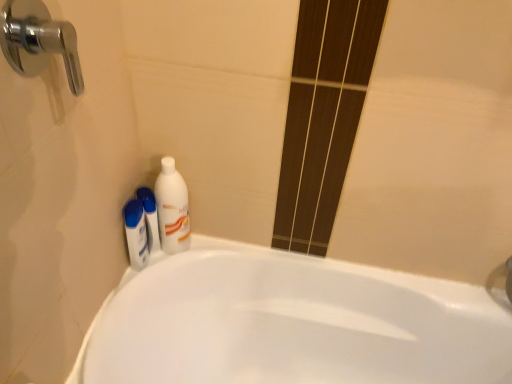
This screenshot has width=512, height=384. What do you see at coordinates (291, 323) in the screenshot? I see `white glossy bathtub at lower left` at bounding box center [291, 323].

Find the location of a particular element. The height and width of the screenshot is (384, 512). chrome metallic faucet at upper left is located at coordinates (38, 41).

In order to click on white glossy bottle at lower left, placed as the 2th mouthwash when sorted from left to right in this screenshot , I will do `click(150, 217)`.

What do you see at coordinates (150, 217) in the screenshot? Image resolution: width=512 pixels, height=384 pixels. I see `white glossy bottle at lower left, placed as the 2th mouthwash when sorted from left to right` at bounding box center [150, 217].

Locate an element on the screen. Image resolution: width=512 pixels, height=384 pixels. white glossy bottle at upper left is located at coordinates (172, 208).

What do you see at coordinates (136, 234) in the screenshot? I see `white glossy mouthwash at lower left, marked as the first mouthwash in a left-to-right arrangement` at bounding box center [136, 234].

Locate an element on the screen. Image resolution: width=512 pixels, height=384 pixels. white glossy bathtub at lower left is located at coordinates (291, 323).

From a real-world perspective, which object stands above the other?

In real-world perspective, white glossy bottle at upper left is above.

Is white glossy bathtub at lower left closer to camera compared to white glossy bottle at upper left?

Yes, it is in front of white glossy bottle at upper left.

Between white glossy bathtub at lower left and white glossy bottle at upper left, which one has larger width?

Wider between the two is white glossy bathtub at lower left.

How far apart are white glossy bathtub at lower left and white glossy bottle at upper left?

white glossy bathtub at lower left is 13.83 inches away from white glossy bottle at upper left.

Which is less distant, (141, 336) or (12, 15)?

Point (141, 336) appears to be farther away from the viewer than point (12, 15).

From the image's perspective, between white glossy bathtub at lower left and chrome metallic faucet at upper left, which one is located above?

From the image's view, chrome metallic faucet at upper left is above.

Based on the photo, measure the distance from white glossy bathtub at lower left to chrome metallic faucet at upper left.

white glossy bathtub at lower left is 81.06 centimeters away from chrome metallic faucet at upper left.

Is white glossy bathtub at lower left spatially inside chrome metallic faucet at upper left, or outside of it?

white glossy bathtub at lower left lies outside chrome metallic faucet at upper left.

Consider the image. Is white glossy bottle at upper left to the right of chrome metallic faucet at upper left from the viewer's perspective?

Correct, you'll find white glossy bottle at upper left to the right of chrome metallic faucet at upper left.

Considering the relative positions of white glossy bottle at upper left and chrome metallic faucet at upper left in the image provided, is white glossy bottle at upper left behind chrome metallic faucet at upper left?

Yes, it is behind chrome metallic faucet at upper left.

Looking at this image, is white glossy bottle at upper left positioned with its back to chrome metallic faucet at upper left?

That's not correct — white glossy bottle at upper left is not looking away from chrome metallic faucet at upper left.

Which of these two, white glossy bottle at upper left or chrome metallic faucet at upper left, is thinner?

With smaller width is chrome metallic faucet at upper left.

Based on the photo, from the image's perspective, is chrome metallic faucet at upper left located above or below white glossy bottle at lower left, the 1th mouthwash from the right?

Based on their image positions, chrome metallic faucet at upper left is located above white glossy bottle at lower left, the 1th mouthwash from the right.

Which of these two, chrome metallic faucet at upper left or white glossy bottle at lower left, placed as the 2th mouthwash when sorted from left to right, is wider?

With larger width is chrome metallic faucet at upper left.

Is the surface of chrome metallic faucet at upper left in direct contact with white glossy bottle at lower left, placed as the 2th mouthwash when sorted from left to right?

No.

Does white glossy mouthwash at lower left, marked as the 2th mouthwash in a right-to-left arrangement, turn towards white glossy bathtub at lower left?

No.

How many degrees apart are the facing directions of white glossy mouthwash at lower left, marked as the first mouthwash in a left-to-right arrangement, and white glossy bathtub at lower left?

The angular difference between white glossy mouthwash at lower left, marked as the first mouthwash in a left-to-right arrangement, and white glossy bathtub at lower left is 0.504 degrees.

Who is taller, white glossy mouthwash at lower left, marked as the first mouthwash in a left-to-right arrangement, or white glossy bathtub at lower left?

Standing taller between the two is white glossy bathtub at lower left.

Considering the relative sizes of white glossy mouthwash at lower left, marked as the first mouthwash in a left-to-right arrangement, and white glossy bathtub at lower left in the image provided, is white glossy mouthwash at lower left, marked as the first mouthwash in a left-to-right arrangement, wider than white glossy bathtub at lower left?

No.

Is white glossy bathtub at lower left positioned with its back to white glossy mouthwash at lower left, marked as the 2th mouthwash in a right-to-left arrangement?

No, white glossy bathtub at lower left is not facing away from white glossy mouthwash at lower left, marked as the 2th mouthwash in a right-to-left arrangement.

Would you say white glossy bathtub at lower left is a long distance from white glossy mouthwash at lower left, marked as the first mouthwash in a left-to-right arrangement?

Actually, white glossy bathtub at lower left and white glossy mouthwash at lower left, marked as the first mouthwash in a left-to-right arrangement, are a little close together.

At what (x,y) coordinates should I click in order to perform the action: click on the 1st mouthwash behind when counting from the white glossy bathtub at lower left. Please return your answer as a coordinate pair (x, y). This screenshot has height=384, width=512. Looking at the image, I should click on (136, 234).

How different are the orientations of white glossy bathtub at lower left and white glossy mouthwash at lower left, marked as the first mouthwash in a left-to-right arrangement, in degrees?

There is a 0.504-degree angle between the facing directions of white glossy bathtub at lower left and white glossy mouthwash at lower left, marked as the first mouthwash in a left-to-right arrangement.

Find the location of `mouthwash that is the 2nd one when counting downward from the white glossy bottle at upper left (from the image's perspective)`. mouthwash that is the 2nd one when counting downward from the white glossy bottle at upper left (from the image's perspective) is located at coordinates (136, 234).

Between white glossy bottle at upper left and white glossy mouthwash at lower left, marked as the first mouthwash in a left-to-right arrangement, which one has more height?

white glossy bottle at upper left is taller.

In the scene shown: Considering the relative positions of white glossy bottle at upper left and white glossy mouthwash at lower left, marked as the first mouthwash in a left-to-right arrangement, in the image provided, is white glossy bottle at upper left to the right of white glossy mouthwash at lower left, marked as the first mouthwash in a left-to-right arrangement, from the viewer's perspective?

Yes.

Is white glossy bottle at upper left aimed at white glossy mouthwash at lower left, marked as the first mouthwash in a left-to-right arrangement?

No, white glossy bottle at upper left is not facing towards white glossy mouthwash at lower left, marked as the first mouthwash in a left-to-right arrangement.

Identify the location of bathtub located below the white glossy bottle at upper left (from the image's perspective). (291, 323).

Find the location of a particular element. The image size is (512, 384). bathtub located behind the chrome metallic faucet at upper left is located at coordinates (291, 323).

Considering their positions, is white glossy bathtub at lower left positioned further to chrome metallic faucet at upper left than white glossy bottle at upper left?

Among the two, white glossy bathtub at lower left is located further to chrome metallic faucet at upper left.

In the scene shown: Which object lies nearer to the anchor point white glossy bottle at lower left, placed as the 2th mouthwash when sorted from left to right, white glossy bottle at upper left or white glossy bathtub at lower left?

Among the two, white glossy bottle at upper left is located nearer to white glossy bottle at lower left, placed as the 2th mouthwash when sorted from left to right.

Looking at the image, which one is located further to white glossy bottle at lower left, the 1th mouthwash from the right, white glossy bathtub at lower left or white glossy bottle at upper left?

white glossy bathtub at lower left lies further to white glossy bottle at lower left, the 1th mouthwash from the right, than the other object.

Looking at the image, which one is located closer to chrome metallic faucet at upper left, white glossy bottle at lower left, placed as the 2th mouthwash when sorted from left to right, or white glossy mouthwash at lower left, marked as the 2th mouthwash in a right-to-left arrangement?

Among the two, white glossy mouthwash at lower left, marked as the 2th mouthwash in a right-to-left arrangement, is located nearer to chrome metallic faucet at upper left.

Consider the image. Based on their spatial positions, is white glossy bottle at lower left, placed as the 2th mouthwash when sorted from left to right, or white glossy mouthwash at lower left, marked as the first mouthwash in a left-to-right arrangement, closer to white glossy bathtub at lower left?

white glossy mouthwash at lower left, marked as the first mouthwash in a left-to-right arrangement.

Looking at this image, considering their positions, is white glossy bottle at lower left, placed as the 2th mouthwash when sorted from left to right, positioned further to white glossy bottle at upper left than white glossy bathtub at lower left?

The object further to white glossy bottle at upper left is white glossy bathtub at lower left.

From the image, which object appears to be farther from white glossy bottle at lower left, placed as the 2th mouthwash when sorted from left to right, white glossy bottle at upper left or white glossy mouthwash at lower left, marked as the 2th mouthwash in a right-to-left arrangement?

Based on the image, white glossy bottle at upper left appears to be further to white glossy bottle at lower left, placed as the 2th mouthwash when sorted from left to right.

Estimate the real-world distances between objects in this image. Which object is closer to chrome metallic faucet at upper left, white glossy bottle at lower left, the 1th mouthwash from the right, or white glossy bottle at upper left?

white glossy bottle at upper left is positioned closer to the anchor chrome metallic faucet at upper left.

The width and height of the screenshot is (512, 384). I want to click on mouthwash between white glossy mouthwash at lower left, marked as the first mouthwash in a left-to-right arrangement, and white glossy bathtub at lower left, in the horizontal direction, so click(x=150, y=217).

Where is `cleaning product between chrome metallic faucet at upper left and white glossy bottle at lower left, the 1th mouthwash from the right, from front to back`? The height and width of the screenshot is (384, 512). cleaning product between chrome metallic faucet at upper left and white glossy bottle at lower left, the 1th mouthwash from the right, from front to back is located at coordinates (172, 208).

I want to click on mouthwash between chrome metallic faucet at upper left and white glossy bottle at lower left, the 1th mouthwash from the right, in the front-back direction, so click(136, 234).

Where is `cleaning product between chrome metallic faucet at upper left and white glossy mouthwash at lower left, marked as the 2th mouthwash in a right-to-left arrangement, along the z-axis`? The width and height of the screenshot is (512, 384). cleaning product between chrome metallic faucet at upper left and white glossy mouthwash at lower left, marked as the 2th mouthwash in a right-to-left arrangement, along the z-axis is located at coordinates (172, 208).